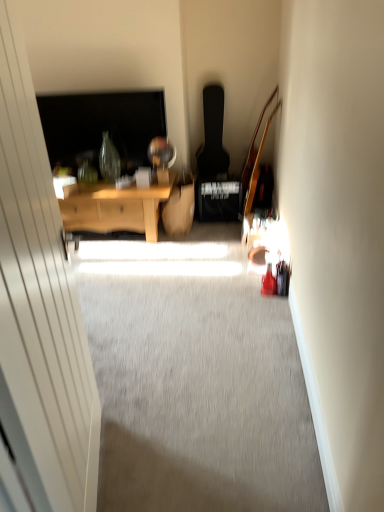
Question: Considering the positions of transparent glass door at left and wooden desk at center in the image, is transparent glass door at left bigger or smaller than wooden desk at center?

Choices:
 (A) small
 (B) big

Answer: (A)

Question: In terms of width, does transparent glass door at left look wider or thinner when compared to wooden desk at center?

Choices:
 (A) wide
 (B) thin

Answer: (B)

Question: Is transparent glass door at left to the left or to the right of wooden desk at center in the image?

Choices:
 (A) left
 (B) right

Answer: (B)

Question: Considering the positions of wooden desk at center and transparent glass door at left in the image, is wooden desk at center taller or shorter than transparent glass door at left?

Choices:
 (A) short
 (B) tall

Answer: (A)

Question: From a real-world perspective, is wooden desk at center physically located above or below transparent glass door at left?

Choices:
 (A) above
 (B) below

Answer: (B)

Question: Would you say wooden desk at center is inside or outside transparent glass door at left?

Choices:
 (A) inside
 (B) outside

Answer: (B)

Question: Considering their positions, is wooden desk at center located in front of or behind transparent glass door at left?

Choices:
 (A) behind
 (B) front

Answer: (A)